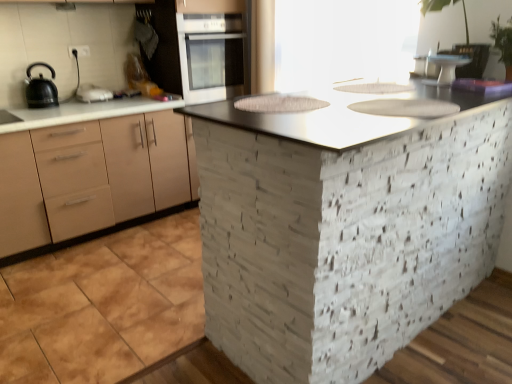
Question: Is transparent glass window screen at upper center not inside white glossy oven at upper center?

Choices:
 (A) yes
 (B) no

Answer: (A)

Question: Are transparent glass window screen at upper center and white glossy oven at upper center beside each other?

Choices:
 (A) yes
 (B) no

Answer: (B)

Question: Is transparent glass window screen at upper center aimed at white glossy oven at upper center?

Choices:
 (A) yes
 (B) no

Answer: (B)

Question: From the image's perspective, would you say transparent glass window screen at upper center is positioned over white glossy oven at upper center?

Choices:
 (A) yes
 (B) no

Answer: (B)

Question: Does transparent glass window screen at upper center appear on the right side of white glossy oven at upper center?

Choices:
 (A) yes
 (B) no

Answer: (A)

Question: Is white glossy sink at center, which is counted as the 2th sink, starting from the top, in front of or behind black matte kettle at left in the image?

Choices:
 (A) front
 (B) behind

Answer: (A)

Question: In terms of width, does white glossy sink at center, which is counted as the 2th sink, starting from the top, look wider or thinner when compared to black matte kettle at left?

Choices:
 (A) wide
 (B) thin

Answer: (A)

Question: Choose the correct answer: Is white glossy sink at center, arranged as the first sink when ordered from the bottom, inside black matte kettle at left or outside it?

Choices:
 (A) inside
 (B) outside

Answer: (B)

Question: Is white glossy sink at center, arranged as the first sink when ordered from the bottom, bigger or smaller than black matte kettle at left?

Choices:
 (A) small
 (B) big

Answer: (A)

Question: From the image's perspective, is white glossy oven at upper center positioned above or below white glossy sink at upper center, which ranks as the second sink in bottom-to-top order?

Choices:
 (A) above
 (B) below

Answer: (A)

Question: From a real-world perspective, is white glossy oven at upper center physically located above or below white glossy sink at upper center, the second sink in the front-to-back sequence?

Choices:
 (A) above
 (B) below

Answer: (A)

Question: Does point (181, 51) appear closer or farther from the camera than point (386, 84)?

Choices:
 (A) closer
 (B) farther

Answer: (B)

Question: Is white glossy oven at upper center wider or thinner than white glossy sink at upper center, the 1th sink in the back-to-front sequence?

Choices:
 (A) wide
 (B) thin

Answer: (A)

Question: Does point (451, 296) appear closer or farther from the camera than point (31, 107)?

Choices:
 (A) closer
 (B) farther

Answer: (A)

Question: Choose the correct answer: Is metallic gray countertop at center inside black matte kettle at left or outside it?

Choices:
 (A) inside
 (B) outside

Answer: (B)